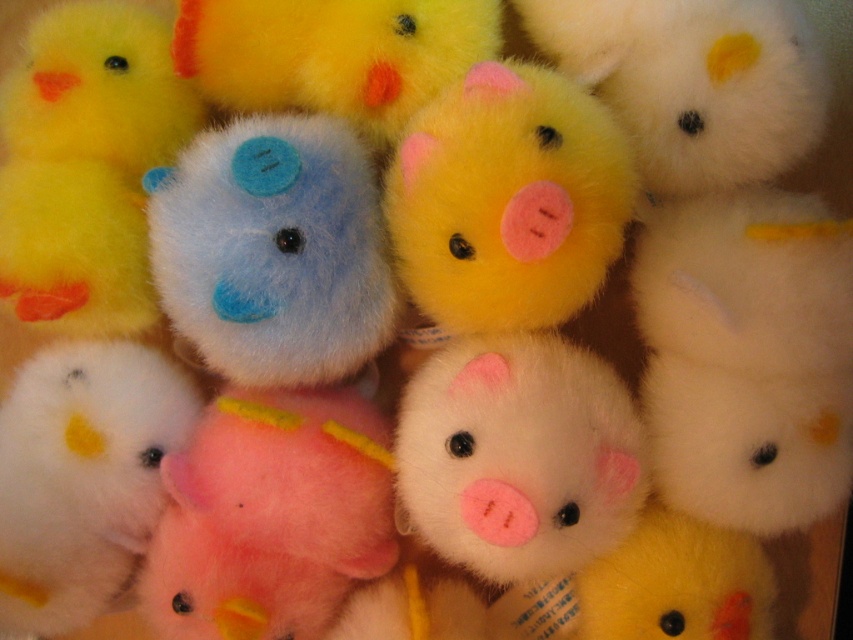
How much distance is there between yellow fuzzy pig at center and yellow plush duck at center?

yellow fuzzy pig at center and yellow plush duck at center are 11.67 inches apart from each other.

Which of these two, yellow fuzzy pig at center or yellow plush duck at center, stands taller?

yellow fuzzy pig at center

Does point (523, 320) lie behind point (705, 573)?

No, (523, 320) is closer to viewer.

Identify the location of yellow fuzzy pig at center. (508, 198).

Which is more to the left, fluffy blue bear at center or pink fluffy pig at center?

pink fluffy pig at center

Is fluffy blue bear at center further to the viewer compared to pink fluffy pig at center?

No, fluffy blue bear at center is closer to the viewer.

Locate an element on the screen. fluffy blue bear at center is located at coordinates (273, 250).

Locate an element on the screen. fluffy blue bear at center is located at coordinates (273, 250).

Who is more distant from viewer, (248,189) or (404,232)?

The point (404,232) is more distant.

Can you confirm if fluffy blue bear at center is positioned to the right of yellow fuzzy pig at center?

In fact, fluffy blue bear at center is to the left of yellow fuzzy pig at center.

Who is more distant from viewer, (242, 282) or (456, 205)?

Point (242, 282)

The height and width of the screenshot is (640, 853). Identify the location of fluffy blue bear at center. (273, 250).